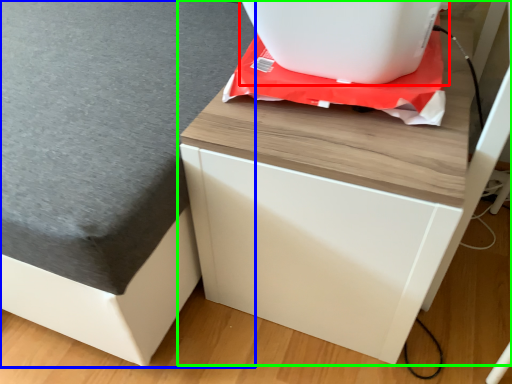
Question: Which object is the closest to the appliance (highlighted by a red box)? Choose among these: table top (highlighted by a blue box) or furniture (highlighted by a green box).

Choices:
 (A) table top
 (B) furniture

Answer: (B)